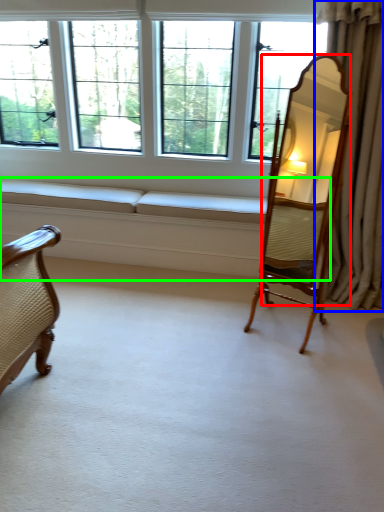
Question: Which object is the closest to the mirror (highlighted by a red box)? Choose among these: curtain (highlighted by a blue box) or couch (highlighted by a green box).

Choices:
 (A) curtain
 (B) couch

Answer: (A)